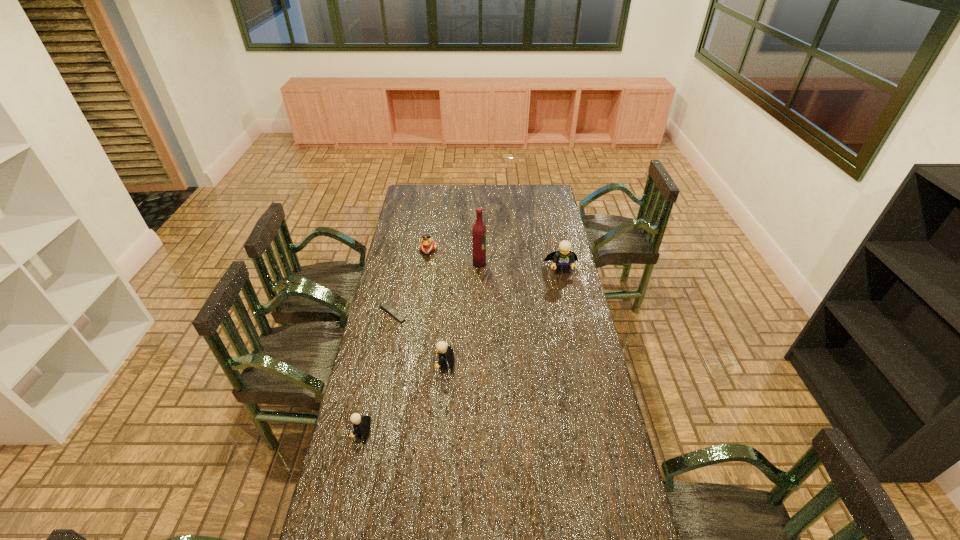
The height and width of the screenshot is (540, 960). In order to click on the nearest Lego in this screenshot , I will do `click(361, 425)`.

Identify the location of the shortest Lego. (361, 425).

At what (x,y) coordinates should I click in order to perform the action: click on the third object from right to left. Please return your answer as a coordinate pair (x, y). The width and height of the screenshot is (960, 540). Looking at the image, I should click on (445, 352).

What are the coordinates of `the second farthest Lego` in the screenshot? It's located at (445, 352).

At what (x,y) coordinates should I click in order to perform the action: click on the fifth shortest object. Please return your answer as a coordinate pair (x, y). This screenshot has width=960, height=540. Looking at the image, I should click on (562, 259).

You are a GUI agent. You are given a task and a screenshot of the screen. Output one action in this format:
    pyautogui.click(x=<x>, y=<y>)
    Task: Click on the tallest Lego
    The width and height of the screenshot is (960, 540).
    Given the screenshot: What is the action you would take?
    pyautogui.click(x=562, y=259)

Where is `duck`? The image size is (960, 540). duck is located at coordinates (428, 245).

Where is `the farthest object`? the farthest object is located at coordinates (428, 245).

At what (x,y) coordinates should I click in order to perform the action: click on the tallest object. Please return your answer as a coordinate pair (x, y). Looking at the image, I should click on (479, 230).

Find the location of a particular element. This screenshot has width=960, height=540. the second object from right to left is located at coordinates (479, 230).